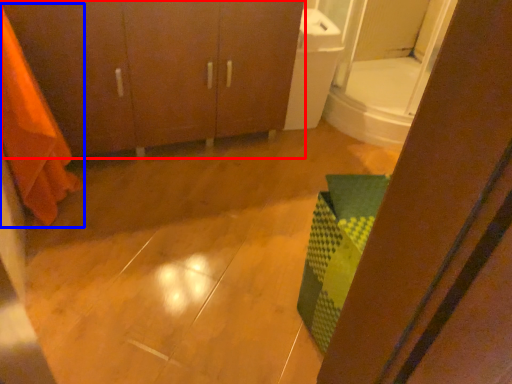
Question: Which object appears closest to the camera in this image, bathroom cabinet (highlighted by a red box) or shower curtain (highlighted by a blue box)?

Choices:
 (A) bathroom cabinet
 (B) shower curtain

Answer: (B)